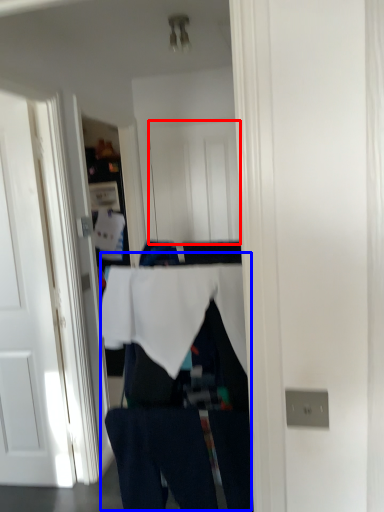
Question: Which object is further to the camera taking this photo, door (highlighted by a red box) or person (highlighted by a blue box)?

Choices:
 (A) door
 (B) person

Answer: (A)